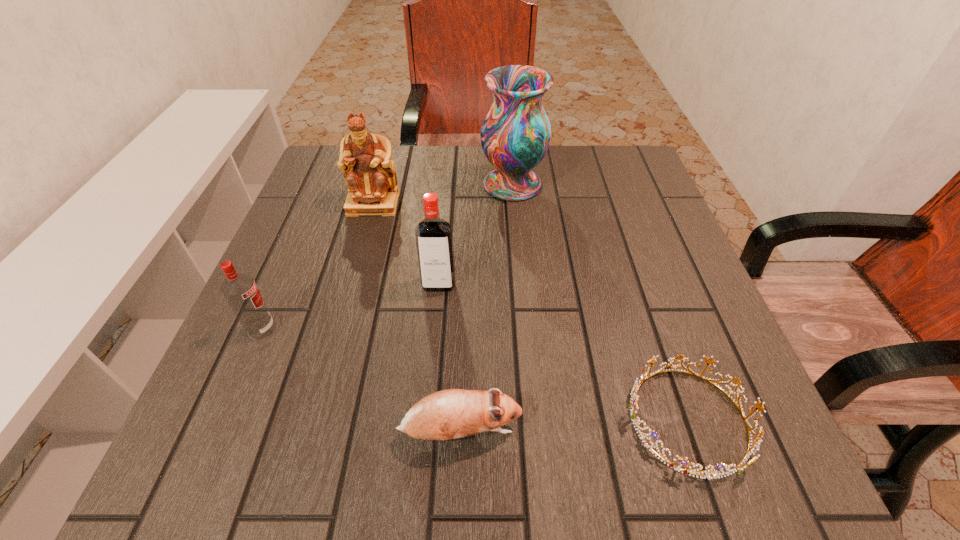
Image resolution: width=960 pixels, height=540 pixels. I want to click on unoccupied position between the farther vodka and the tallest object, so click(475, 234).

Where is `vacant space in between the shortest object and the taller vodka`? Image resolution: width=960 pixels, height=540 pixels. vacant space in between the shortest object and the taller vodka is located at coordinates (564, 352).

Identify which object is the second nearest to the fifth tallest object. Please provide its 2D coordinates. Your answer should be formatted as a tuple, i.e. [(x, y)], where the tuple contains the x and y coordinates of a point satisfying the conditions above.

[(434, 240)]

Locate an element on the screen. object that is the third closest one to the rightmost object is located at coordinates pos(515,134).

Identify the location of vacant area that satisfies the following two spatial constraints: 1. on the front side of the tallest object; 2. at the face of the hamster. The width and height of the screenshot is (960, 540). (535, 432).

The height and width of the screenshot is (540, 960). Find the location of `free space in the image that satisfies the following two spatial constraints: 1. on the front and back of the farther vodka; 2. on the front label of the leftmost object`. free space in the image that satisfies the following two spatial constraints: 1. on the front and back of the farther vodka; 2. on the front label of the leftmost object is located at coordinates (435, 329).